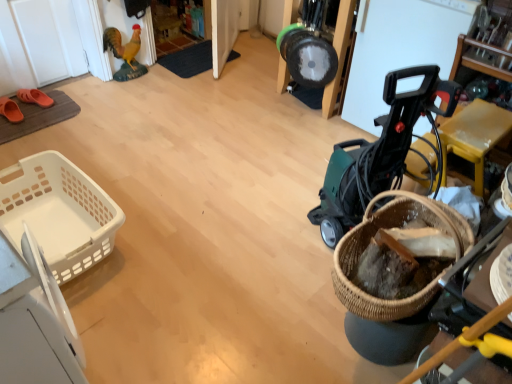
Locate an element on the screen. This screenshot has width=512, height=384. vacant area located to the right-hand side of orange rubber sandals at left, which appears as the 1th footwear when viewed from the front is located at coordinates (39, 118).